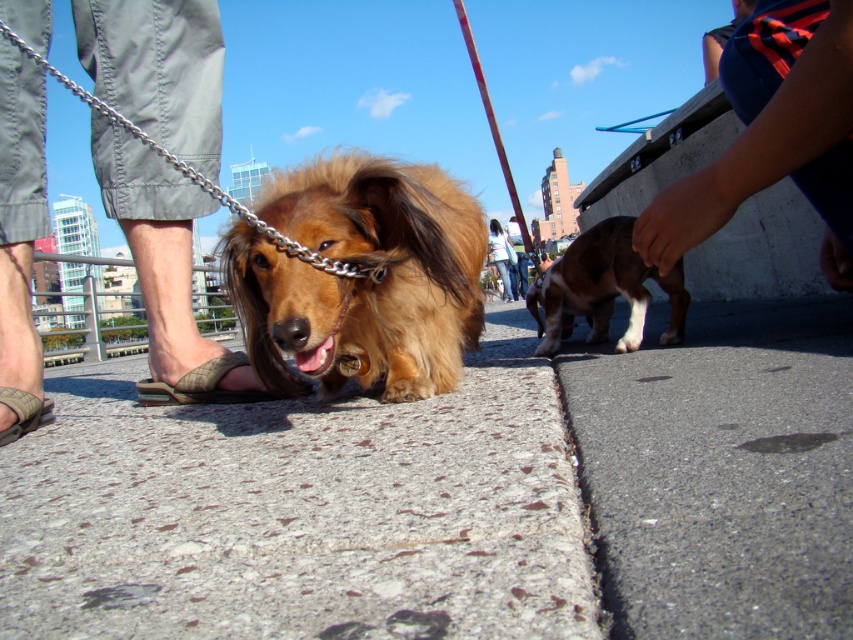
Question: Does blue fabric shirt at upper right have a larger size compared to gray concrete curb at lower center?

Choices:
 (A) no
 (B) yes

Answer: (A)

Question: In this image, where is blue fabric shirt at upper right located relative to denim pants at center?

Choices:
 (A) above
 (B) below

Answer: (B)

Question: Which object appears farthest from the camera in this image?

Choices:
 (A) shiny brown fur at center
 (B) gray concrete curb at lower center

Answer: (A)

Question: Which object is positioned farthest from the denim pants at center?

Choices:
 (A) blue fabric shirt at upper right
 (B) gray asphalt at lower right
 (C) gray concrete curb at lower center

Answer: (A)

Question: Is brown and white fur at right positioned behind gray concrete curb at lower center?

Choices:
 (A) yes
 (B) no

Answer: (A)

Question: Which point appears farthest from the camera in this image?

Choices:
 (A) (838, 132)
 (B) (635, 321)
 (C) (86, 541)
 (D) (358, 253)

Answer: (B)